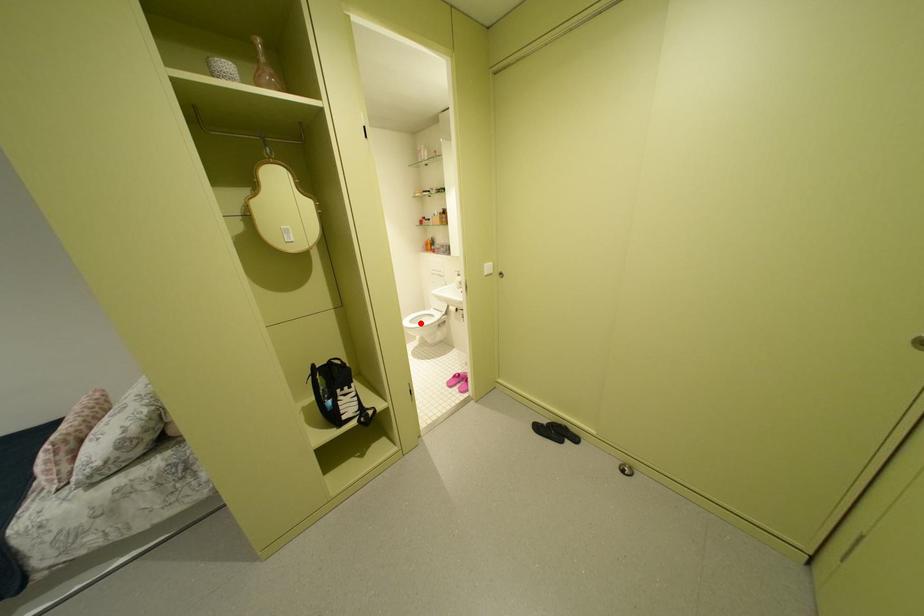
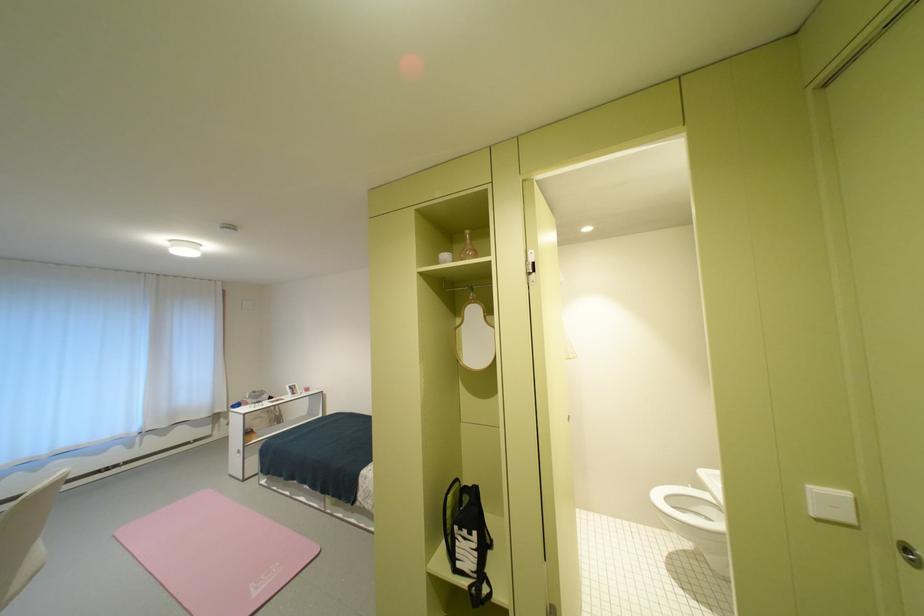
In the second image, find the point that corresponds to the highlighted location in the first image.

(677, 500)